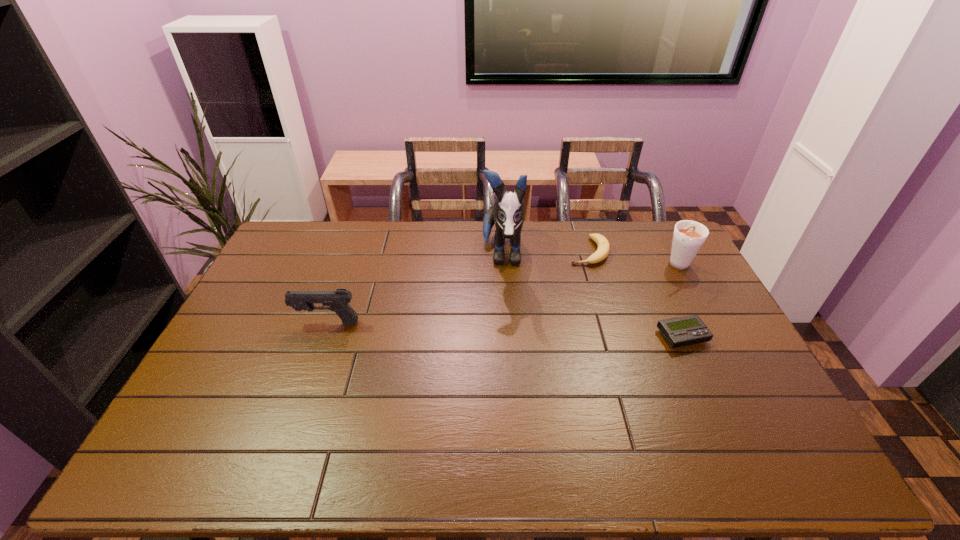
I want to click on vacant space at the far left corner, so click(x=304, y=238).

Find the location of a particular element. vacant space that is in between the tallest object and the beeper is located at coordinates (592, 295).

Locate an element on the screen. Image resolution: width=960 pixels, height=540 pixels. free space that is in between the second tallest object and the pistol is located at coordinates (503, 294).

Locate an element on the screen. The width and height of the screenshot is (960, 540). empty space between the banana and the beeper is located at coordinates (636, 294).

Identify the location of empty space that is in between the second tallest object and the beeper. The height and width of the screenshot is (540, 960). (681, 301).

The image size is (960, 540). I want to click on empty space that is in between the third object from right to left and the fourth object from right to left, so click(x=545, y=253).

Where is `vacant area that lies between the beeper and the second tallest object`? This screenshot has width=960, height=540. vacant area that lies between the beeper and the second tallest object is located at coordinates (681, 301).

Locate an element on the screen. This screenshot has width=960, height=540. free point between the banana and the leftmost object is located at coordinates (458, 287).

You are a GUI agent. You are given a task and a screenshot of the screen. Output one action in this format:
    pyautogui.click(x=<x>, y=<y>)
    Task: Click on the free space between the beeper and the pistol
    The image size is (960, 540).
    Given the screenshot: What is the action you would take?
    pyautogui.click(x=505, y=329)

The height and width of the screenshot is (540, 960). What are the coordinates of `vacant point located between the third object from right to left and the root beer` in the screenshot? It's located at (634, 258).